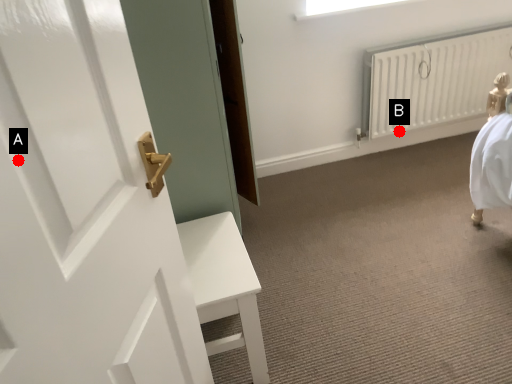
Question: Two points are circled on the image, labeled by A and B beside each circle. Which point is closer to the camera?

Choices:
 (A) A is closer
 (B) B is closer

Answer: (A)